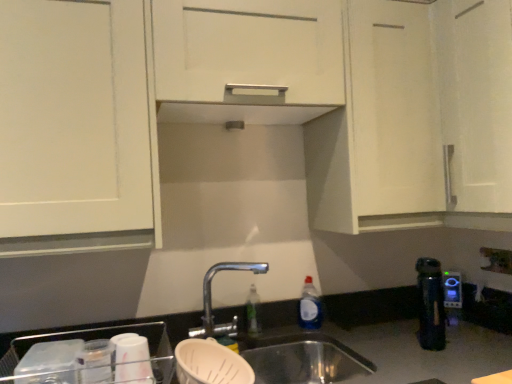
Question: Is blue plastic bottle at sink at the right side of blue plastic kettle at right?

Choices:
 (A) yes
 (B) no

Answer: (B)

Question: Is blue plastic bottle at sink beside blue plastic kettle at right?

Choices:
 (A) no
 (B) yes

Answer: (A)

Question: Is blue plastic bottle at sink completely or partially outside of blue plastic kettle at right?

Choices:
 (A) no
 (B) yes

Answer: (B)

Question: From a real-world perspective, is blue plastic bottle at sink located higher than blue plastic kettle at right?

Choices:
 (A) yes
 (B) no

Answer: (A)

Question: Does blue plastic bottle at sink have a lesser width compared to blue plastic kettle at right?

Choices:
 (A) yes
 (B) no

Answer: (B)

Question: Is stainless steel sink at lower center inside the boundaries of white matte cabinet at upper center, or outside?

Choices:
 (A) outside
 (B) inside

Answer: (A)

Question: Considering the positions of stainless steel sink at lower center and white matte cabinet at upper center in the image, is stainless steel sink at lower center wider or thinner than white matte cabinet at upper center?

Choices:
 (A) wide
 (B) thin

Answer: (A)

Question: From the image's perspective, is stainless steel sink at lower center positioned above or below white matte cabinet at upper center?

Choices:
 (A) above
 (B) below

Answer: (B)

Question: Does point (274, 370) appear closer or farther from the camera than point (466, 1)?

Choices:
 (A) farther
 (B) closer

Answer: (A)

Question: From a real-world perspective, is blue plastic kettle at right physically located above or below white plastic electric outlet at lower right?

Choices:
 (A) below
 (B) above

Answer: (A)

Question: Is blue plastic kettle at right taller or shorter than white plastic electric outlet at lower right?

Choices:
 (A) short
 (B) tall

Answer: (B)

Question: From the image's perspective, is blue plastic kettle at right located above or below white plastic electric outlet at lower right?

Choices:
 (A) above
 (B) below

Answer: (B)

Question: Is blue plastic kettle at right bigger or smaller than white plastic electric outlet at lower right?

Choices:
 (A) big
 (B) small

Answer: (A)

Question: From the image's perspective, is white matte cabinet at upper center located above or below white plastic electric outlet at lower right?

Choices:
 (A) below
 (B) above

Answer: (B)

Question: Is white matte cabinet at upper center wider or thinner than white plastic electric outlet at lower right?

Choices:
 (A) wide
 (B) thin

Answer: (A)